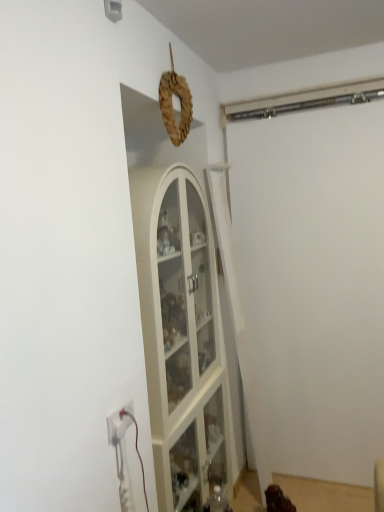
What do you see at coordinates (314, 282) in the screenshot? I see `white matte garage door at right` at bounding box center [314, 282].

Find the location of a particular element. white matte garage door at right is located at coordinates (314, 282).

Describe the element at coordinates (119, 423) in the screenshot. I see `white plastic electric outlet at lower left` at that location.

Where is `white plastic electric outlet at lower left`? white plastic electric outlet at lower left is located at coordinates (119, 423).

Identify the location of white matte garage door at right. (314, 282).

Which object is positioned more to the right, white matte garage door at right or white plastic electric outlet at lower left?

white matte garage door at right is more to the right.

Which is behind, white matte garage door at right or white plastic electric outlet at lower left?

white matte garage door at right is further from the camera.

Which is in front, point (321, 254) or point (132, 402)?

Positioned in front is point (132, 402).

From the image's perspective, which object appears higher, white matte garage door at right or white plastic electric outlet at lower left?

white matte garage door at right is shown above in the image.

From a real-world perspective, is white matte garage door at right positioned under white plastic electric outlet at lower left based on gravity?

No, from a real-world perspective, white matte garage door at right is not beneath white plastic electric outlet at lower left.

Which object is wider, white matte garage door at right or white plastic electric outlet at lower left?

Wider between the two is white matte garage door at right.

Which of these two, white matte garage door at right or white plastic electric outlet at lower left, stands shorter?

white plastic electric outlet at lower left.

Can you confirm if white matte garage door at right is smaller than white plastic electric outlet at lower left?

No, white matte garage door at right is not smaller than white plastic electric outlet at lower left.

Is white matte garage door at right surrounding white plastic electric outlet at lower left?

No, white plastic electric outlet at lower left is not surrounded by white matte garage door at right.

Is white matte garage door at right not near white plastic electric outlet at lower left?

white matte garage door at right is positioned a significant distance from white plastic electric outlet at lower left.

Could you tell me if white matte garage door at right is turned towards white plastic electric outlet at lower left?

Yes, white matte garage door at right faces towards white plastic electric outlet at lower left.

The image size is (384, 512). I want to click on garage door above the white plastic electric outlet at lower left (from a real-world perspective), so click(x=314, y=282).

Looking at this image, considering the relative positions of white plastic electric outlet at lower left and white matte garage door at right in the image provided, is white plastic electric outlet at lower left to the right of white matte garage door at right from the viewer's perspective?

No, white plastic electric outlet at lower left is not to the right of white matte garage door at right.

In the image, is white plastic electric outlet at lower left positioned in front of or behind white matte garage door at right?

In the image, white plastic electric outlet at lower left appears in front of white matte garage door at right.

Is point (119, 432) behind point (321, 131)?

No, it is in front of (321, 131).

From the image's perspective, is white plastic electric outlet at lower left above or below white matte garage door at right?

Based on their image positions, white plastic electric outlet at lower left is located beneath white matte garage door at right.

From a real-world perspective, who is located lower, white plastic electric outlet at lower left or white matte garage door at right?

In real-world perspective, white plastic electric outlet at lower left is lower.

In terms of width, does white plastic electric outlet at lower left look wider or thinner when compared to white matte garage door at right?

Considering their sizes, white plastic electric outlet at lower left looks slimmer than white matte garage door at right.

In terms of height, does white plastic electric outlet at lower left look taller or shorter compared to white matte garage door at right?

Considering their sizes, white plastic electric outlet at lower left has less height than white matte garage door at right.

Considering the relative sizes of white plastic electric outlet at lower left and white matte garage door at right in the image provided, is white plastic electric outlet at lower left smaller than white matte garage door at right?

Indeed, white plastic electric outlet at lower left has a smaller size compared to white matte garage door at right.

Is white plastic electric outlet at lower left located outside white matte garage door at right?

Absolutely, white plastic electric outlet at lower left is external to white matte garage door at right.

Is white plastic electric outlet at lower left directly adjacent to white matte garage door at right?

white plastic electric outlet at lower left is not next to white matte garage door at right, and they're not touching.

Is white plastic electric outlet at lower left facing towards white matte garage door at right?

No, white plastic electric outlet at lower left is not oriented towards white matte garage door at right.

How much distance is there between white plastic electric outlet at lower left and white matte garage door at right?

A distance of 4.50 feet exists between white plastic electric outlet at lower left and white matte garage door at right.

Find the location of a particular element. The height and width of the screenshot is (512, 384). garage door above the white plastic electric outlet at lower left (from a real-world perspective) is located at coordinates (314, 282).

The height and width of the screenshot is (512, 384). In the image, there is a white matte garage door at right. Find the location of `electric outlet below it (from a real-world perspective)`. electric outlet below it (from a real-world perspective) is located at coordinates (119, 423).

Locate an element on the screen. The height and width of the screenshot is (512, 384). garage door located behind the white plastic electric outlet at lower left is located at coordinates (314, 282).